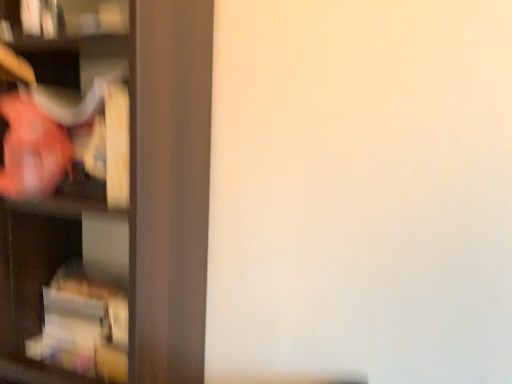
Where is `matte brown shelf at left`? matte brown shelf at left is located at coordinates (111, 194).

What do you see at coordinates (111, 194) in the screenshot? This screenshot has width=512, height=384. I see `matte brown shelf at left` at bounding box center [111, 194].

In order to face matte brown shelf at left, should I rotate leftwards or rightwards?

You should look left and rotate roughly 19.369 degrees.

The image size is (512, 384). What do you see at coordinates (62, 299) in the screenshot? I see `matte plastic cabinet at left` at bounding box center [62, 299].

What is the approximate width of matte plastic cabinet at left?

matte plastic cabinet at left is 7.84 inches wide.

Locate an element on the screen. This screenshot has width=512, height=384. matte plastic cabinet at left is located at coordinates (62, 299).

The image size is (512, 384). Find the location of `matte brown shelf at left`. matte brown shelf at left is located at coordinates (111, 194).

Which is more to the left, matte brown shelf at left or matte plastic cabinet at left?

Positioned to the left is matte plastic cabinet at left.

Which object is closer to the camera, matte brown shelf at left or matte plastic cabinet at left?

matte brown shelf at left is more forward.

Which is more distant, (x=170, y=325) or (x=67, y=263)?

Point (x=67, y=263)

In the scene shown: From the image's perspective, which one is positioned higher, matte brown shelf at left or matte plastic cabinet at left?

From the image's view, matte brown shelf at left is above.

Looking at this image, from a real-world perspective, is matte brown shelf at left above or below matte plastic cabinet at left?

From a real-world perspective, matte brown shelf at left is physically above matte plastic cabinet at left.

Considering the sizes of objects matte brown shelf at left and matte plastic cabinet at left in the image provided, who is wider, matte brown shelf at left or matte plastic cabinet at left?

matte brown shelf at left.

Is matte brown shelf at left taller than matte plastic cabinet at left?

Yes.

Considering the sizes of objects matte brown shelf at left and matte plastic cabinet at left in the image provided, who is smaller, matte brown shelf at left or matte plastic cabinet at left?

Smaller between the two is matte plastic cabinet at left.

Is matte brown shelf at left not within matte plastic cabinet at left?

Yes.

Is matte brown shelf at left next to matte plastic cabinet at left and touching it?

No.

Is matte brown shelf at left looking in the opposite direction of matte plastic cabinet at left?

Yes, matte brown shelf at left is facing away from matte plastic cabinet at left.

In the scene shown: What's the angular difference between matte brown shelf at left and matte plastic cabinet at left's facing directions?

The facing directions of matte brown shelf at left and matte plastic cabinet at left are 0.634 degrees apart.

How far apart are matte brown shelf at left and matte plastic cabinet at left?

They are 4.64 inches apart.

The image size is (512, 384). Find the location of `cabinet lying on the left of matte brown shelf at left`. cabinet lying on the left of matte brown shelf at left is located at coordinates (62, 299).

Which object is positioned more to the right, matte plastic cabinet at left or matte brown shelf at left?

From the viewer's perspective, matte brown shelf at left appears more on the right side.

Which object is further away from the camera taking this photo, matte plastic cabinet at left or matte brown shelf at left?

Positioned behind is matte plastic cabinet at left.

Does point (62, 259) lie behind point (42, 134)?

Yes, point (62, 259) is farther from viewer.

From the picture: From the image's perspective, is matte plastic cabinet at left above or below matte brown shelf at left?

From the image's perspective, matte plastic cabinet at left appears below matte brown shelf at left.

From a real-world perspective, is matte plastic cabinet at left physically located above or below matte brown shelf at left?

Clearly, from a real-world perspective, matte plastic cabinet at left is below matte brown shelf at left.

Between matte plastic cabinet at left and matte brown shelf at left, which one has smaller width?

matte plastic cabinet at left.

Which of these two, matte plastic cabinet at left or matte brown shelf at left, stands shorter?

matte plastic cabinet at left.

Does matte plastic cabinet at left have a larger size compared to matte brown shelf at left?

Incorrect, matte plastic cabinet at left is not larger than matte brown shelf at left.

Would you say matte plastic cabinet at left is inside or outside matte brown shelf at left?

matte plastic cabinet at left exists entirely within matte brown shelf at left.

Would you say matte plastic cabinet at left is a long distance from matte brown shelf at left?

No, matte plastic cabinet at left is not far from matte brown shelf at left.

Is matte plastic cabinet at left facing away from matte brown shelf at left?

Absolutely, matte plastic cabinet at left is directed away from matte brown shelf at left.

Measure the distance from matte plastic cabinet at left to matte brown shelf at left.

matte plastic cabinet at left is 4.64 inches from matte brown shelf at left.

This screenshot has height=384, width=512. I want to click on shelf lying above the matte plastic cabinet at left (from the image's perspective), so click(111, 194).

At what (x,y) coordinates should I click in order to perform the action: click on shelf that appears in front of the matte plastic cabinet at left. Please return your answer as a coordinate pair (x, y). Looking at the image, I should click on (111, 194).

Where is `shelf above the matte plastic cabinet at left (from the image's perspective)`? The height and width of the screenshot is (384, 512). shelf above the matte plastic cabinet at left (from the image's perspective) is located at coordinates pyautogui.click(x=111, y=194).